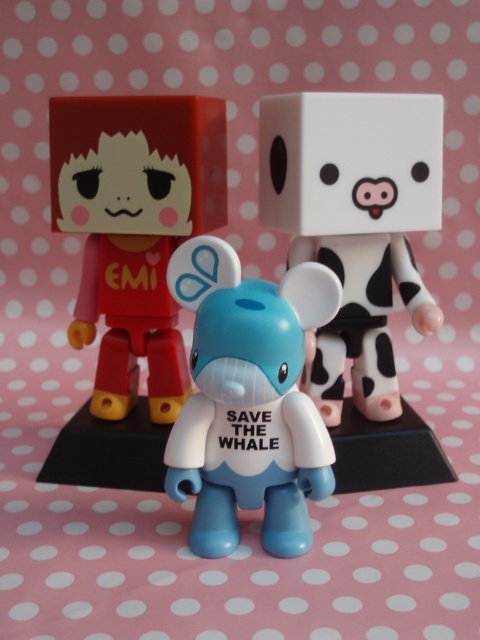
Which is more to the right, white matte cube at center or matte red cube at left?

white matte cube at center is more to the right.

Is white matte cube at center positioned behind matte red cube at left?

No.

Describe the element at coordinates (355, 224) in the screenshot. I see `white matte cube at center` at that location.

You are a GUI agent. You are given a task and a screenshot of the screen. Output one action in this format:
    pyautogui.click(x=<x>, y=<y>)
    Task: Click on the white matte cube at center
    The width and height of the screenshot is (480, 640).
    Given the screenshot: What is the action you would take?
    pyautogui.click(x=355, y=224)

Does matte red cube at left have a greater width compared to blue matte toy at center?

Correct, the width of matte red cube at left exceeds that of blue matte toy at center.

At what (x,y) coordinates should I click in order to perform the action: click on matte red cube at left. Please return your answer as a coordinate pair (x, y). Looking at the image, I should click on (134, 228).

I want to click on matte red cube at left, so click(x=134, y=228).

Can you confirm if white matte cube at center is taller than blue matte toy at center?

Yes, white matte cube at center is taller than blue matte toy at center.

Does white matte cube at center appear under blue matte toy at center?

No, white matte cube at center is not below blue matte toy at center.

The image size is (480, 640). In order to click on white matte cube at center in this screenshot , I will do `click(355, 224)`.

I want to click on white matte cube at center, so click(355, 224).